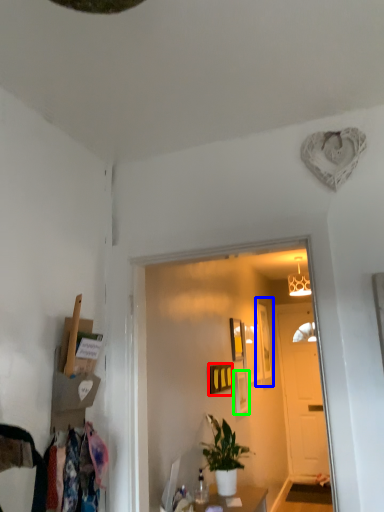
Question: Based on their relative distances, which object is farther from picture frame (highlighted by a red box)? Choose from picture frame (highlighted by a blue box) and picture frame (highlighted by a green box).

Choices:
 (A) picture frame
 (B) picture frame

Answer: (A)